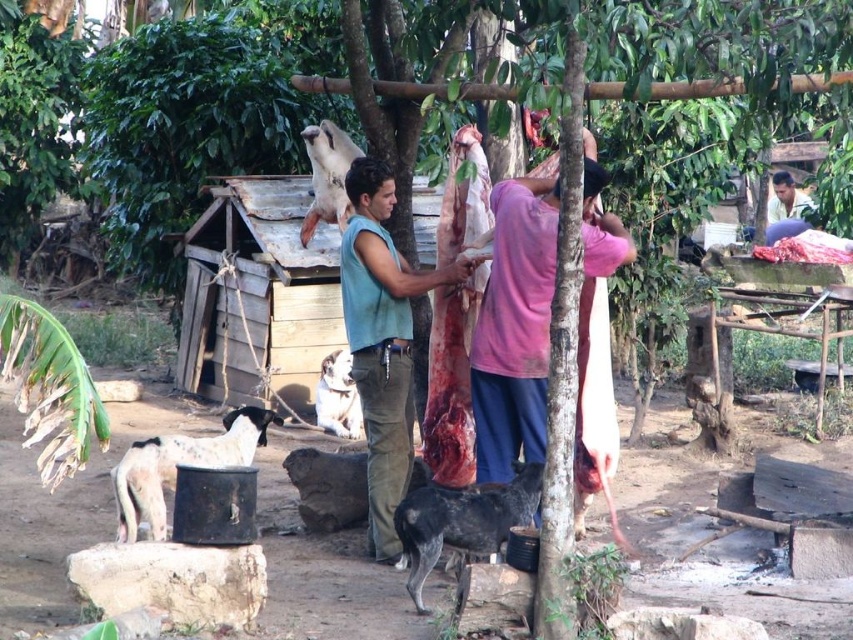
In the rural butchering scene, there are two dogs present. The spotted fur dog at lower center and the white fur dog at lower left. Which dog is smaller in size?

The spotted fur dog at lower center is smaller than the white fur dog at lower left.

You are standing at the point with coordinates point (135, 499) and want to move to the point with coordinates point (426, 486). Is the destination point in front of you or behind you?

Point (426, 486) is in front of point (135, 499), so the destination point is in front of you.

You are a farmer who needs to choose between two dogs to help with herding tasks. The spotted fur dog at lower center and the white fur dog at center are both available. Based on their sizes, which dog would be more suitable for herding larger livestock?

The spotted fur dog at lower center is wider than the white fur dog at center, so it would be more suitable for herding larger livestock due to its larger size.